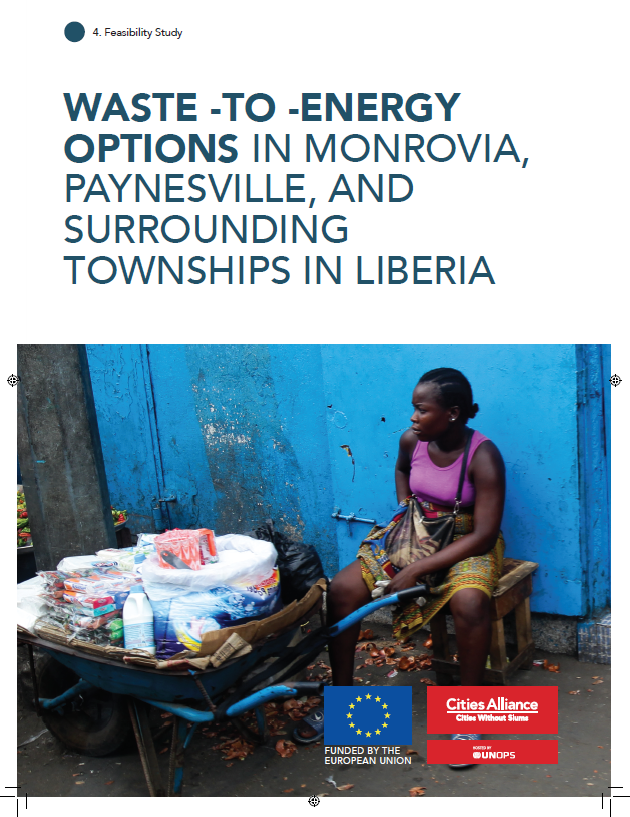
Locate an element on the screen. left handle is located at coordinates (305, 685).